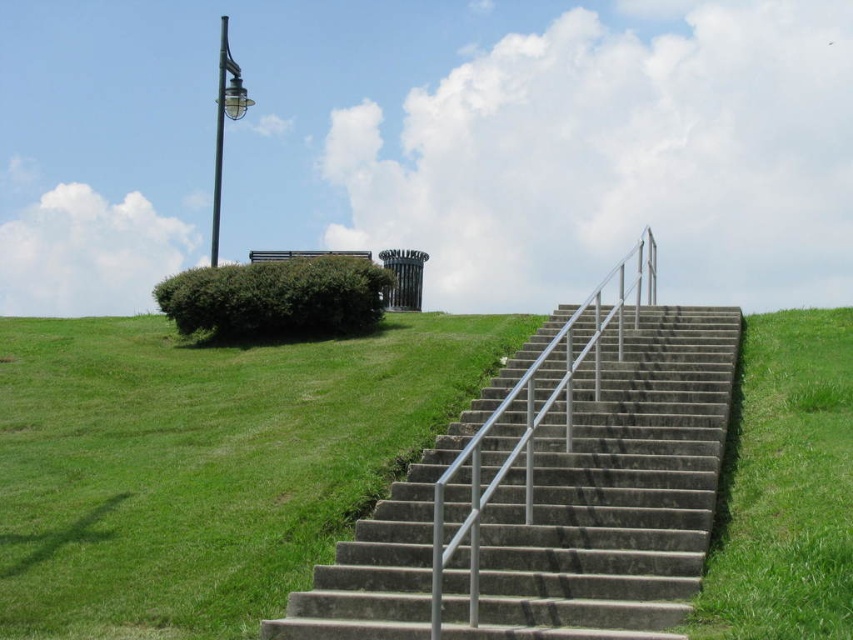
Is the position of green leafy bush at upper left more distant than that of silver metallic handrail at center?

Yes, it is behind silver metallic handrail at center.

Between point (311, 321) and point (596, 374), which one is positioned behind?

Positioned behind is point (311, 321).

This screenshot has height=640, width=853. Identify the location of green leafy bush at upper left. (276, 298).

Find the location of `green leafy bush at upper left`. green leafy bush at upper left is located at coordinates (276, 298).

You are a GUI agent. You are given a task and a screenshot of the screen. Output one action in this format:
    pyautogui.click(x=<x>, y=<y>)
    Task: Click on the green grass at lower left
    The width and height of the screenshot is (853, 640).
    Given the screenshot: What is the action you would take?
    pyautogui.click(x=206, y=464)

Identify the location of green grass at lower left. This screenshot has height=640, width=853. (206, 464).

Which is more to the left, concrete/stone stairs at center or green leafy bush at upper left?

Positioned to the left is green leafy bush at upper left.

Is the position of concrete/stone stairs at center less distant than that of green leafy bush at upper left?

Yes, concrete/stone stairs at center is in front of green leafy bush at upper left.

This screenshot has height=640, width=853. What are the coordinates of `concrete/stone stairs at center` in the screenshot? It's located at (610, 493).

This screenshot has height=640, width=853. I want to click on concrete/stone stairs at center, so click(x=610, y=493).